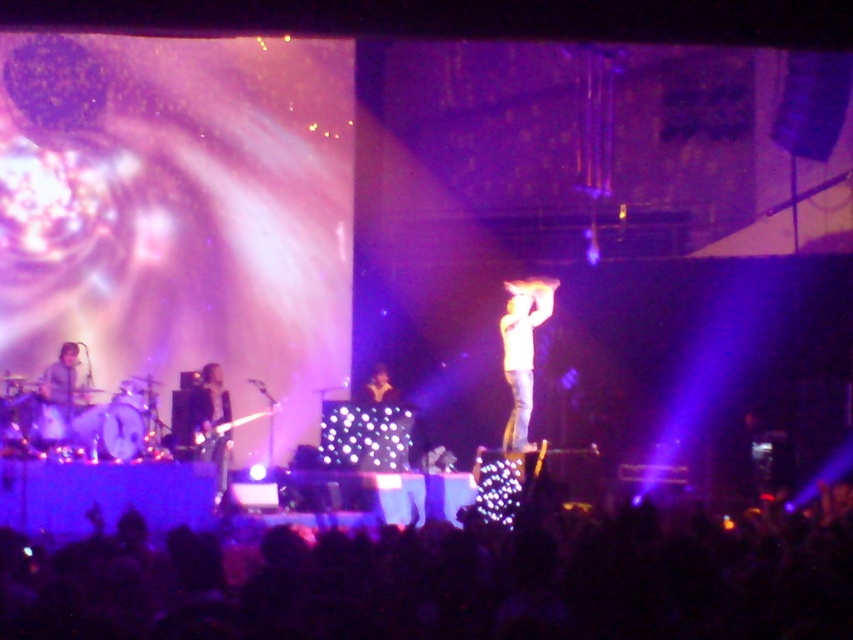
Question: Does matte gray shirt at left have a larger size compared to shiny silver guitar at center?

Choices:
 (A) no
 (B) yes

Answer: (B)

Question: Among these objects, which one is farthest from the camera?

Choices:
 (A) shiny black guitar at lower left
 (B) shiny silver guitar at center

Answer: (B)

Question: Among these points, which one is farthest from the camera?

Choices:
 (A) (57, 387)
 (B) (515, 378)

Answer: (B)

Question: Among these objects, which one is farthest from the camera?

Choices:
 (A) matte gray shirt at left
 (B) black fabric crowd at lower center
 (C) shiny black guitar at lower left

Answer: (C)

Question: Does white matte shirt at center have a larger size compared to shiny black guitar at lower left?

Choices:
 (A) no
 (B) yes

Answer: (A)

Question: Is shiny black guitar at lower left positioned in front of shiny silver guitar at center?

Choices:
 (A) no
 (B) yes

Answer: (B)